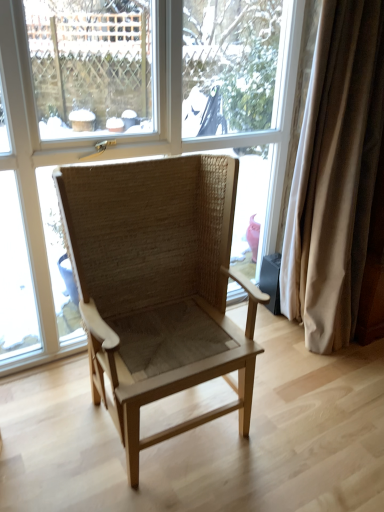
Question: From a real-world perspective, is transparent glass window at center beneath beige fabric curtain at right?

Choices:
 (A) yes
 (B) no

Answer: (B)

Question: Can you confirm if transparent glass window at center is shorter than beige fabric curtain at right?

Choices:
 (A) no
 (B) yes

Answer: (A)

Question: Considering the relative sizes of transparent glass window at center and beige fabric curtain at right in the image provided, is transparent glass window at center wider than beige fabric curtain at right?

Choices:
 (A) yes
 (B) no

Answer: (B)

Question: From a real-world perspective, is transparent glass window at center on beige fabric curtain at right?

Choices:
 (A) no
 (B) yes

Answer: (B)

Question: Is transparent glass window at center next to beige fabric curtain at right?

Choices:
 (A) yes
 (B) no

Answer: (B)

Question: Can you confirm if transparent glass window at center is smaller than beige fabric curtain at right?

Choices:
 (A) yes
 (B) no

Answer: (B)

Question: Is transparent glass window at center outside natural woven chair at center?

Choices:
 (A) yes
 (B) no

Answer: (A)

Question: Is transparent glass window at center facing away from natural woven chair at center?

Choices:
 (A) no
 (B) yes

Answer: (B)

Question: Can you confirm if transparent glass window at center is bigger than natural woven chair at center?

Choices:
 (A) yes
 (B) no

Answer: (B)

Question: Is the depth of transparent glass window at center less than that of natural woven chair at center?

Choices:
 (A) yes
 (B) no

Answer: (B)

Question: Does transparent glass window at center have a greater width compared to natural woven chair at center?

Choices:
 (A) no
 (B) yes

Answer: (A)

Question: Considering the relative positions of transparent glass window at center and natural woven chair at center in the image provided, is transparent glass window at center behind natural woven chair at center?

Choices:
 (A) yes
 (B) no

Answer: (A)

Question: Does natural woven chair at center turn towards beige fabric curtain at right?

Choices:
 (A) no
 (B) yes

Answer: (A)